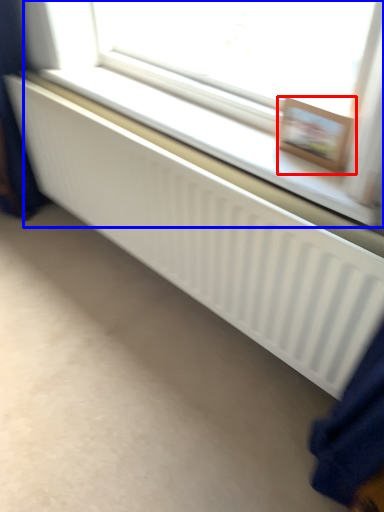
Question: Which object appears farthest to the camera in this image, picture frame (highlighted by a red box) or bay window (highlighted by a blue box)?

Choices:
 (A) picture frame
 (B) bay window

Answer: (A)